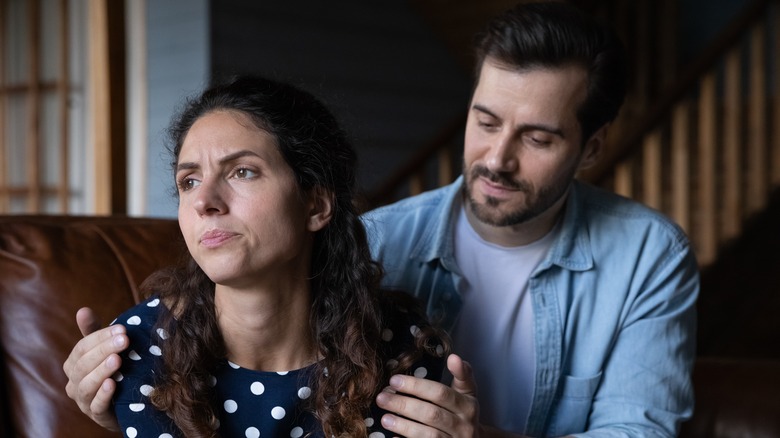
Where is `leather sofa`? leather sofa is located at coordinates (48, 249).